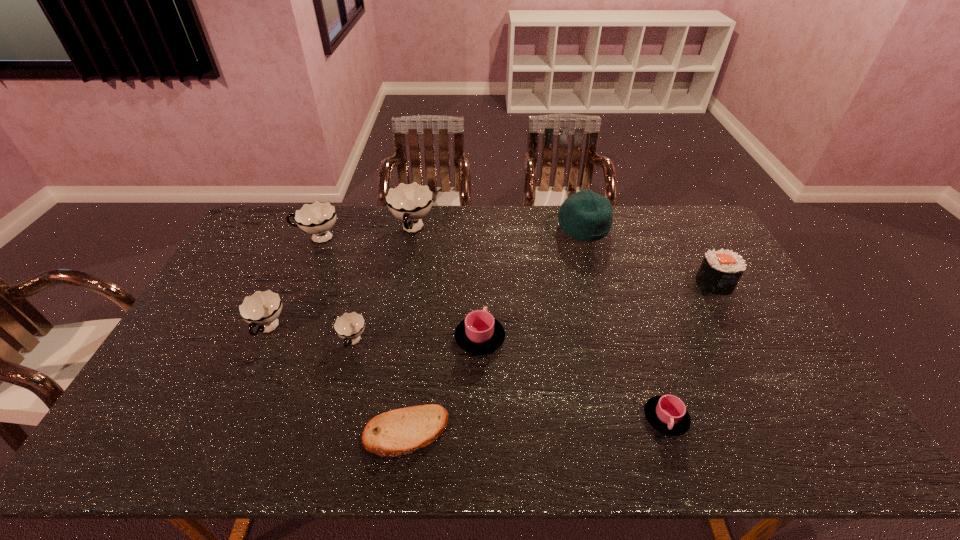
I want to click on free region at the far left corner, so click(x=287, y=236).

The image size is (960, 540). Identify the location of vacant space at the far right corner of the desktop. (687, 208).

Find the location of a particular element. The width and height of the screenshot is (960, 540). empty space between the shortest object and the smallest white cup is located at coordinates (379, 387).

The width and height of the screenshot is (960, 540). In order to click on vacant space that's between the smallest white cup and the third smallest white cup in this screenshot , I will do `click(335, 291)`.

Where is `free point between the shortest object and the tallest cup`? free point between the shortest object and the tallest cup is located at coordinates (409, 331).

The height and width of the screenshot is (540, 960). What are the coordinates of `blank region between the beanie and the tallest cup` in the screenshot? It's located at (498, 229).

Where is `free space between the second cup from right to left and the third biggest white cup`? The image size is (960, 540). free space between the second cup from right to left and the third biggest white cup is located at coordinates (374, 334).

At what (x,y) coordinates should I click in order to perform the action: click on vacant point located between the second smallest white cup and the shortest cup. Please return your answer as a coordinate pair (x, y). This screenshot has width=960, height=540. Looking at the image, I should click on (467, 374).

You are a GUI agent. You are given a task and a screenshot of the screen. Output one action in this format:
    pyautogui.click(x=<x>, y=<y>)
    Task: Click on the vacant region between the right pink cup and the beanie
    
    Given the screenshot: What is the action you would take?
    pyautogui.click(x=625, y=323)

Find the location of a particular element. The image size is (960, 540). empty space that is in between the nearest cup and the smallest white cup is located at coordinates (510, 380).